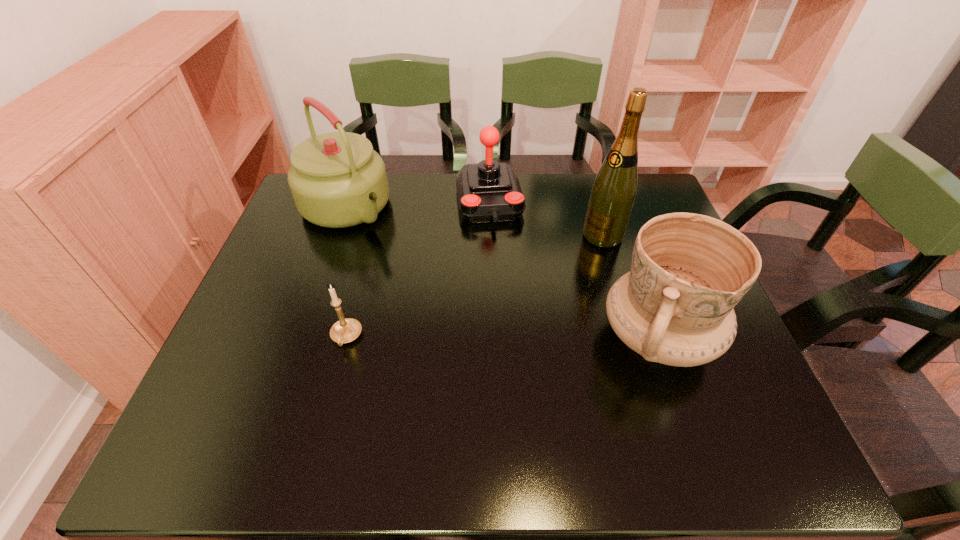
The height and width of the screenshot is (540, 960). In order to click on the shortest object in this screenshot , I will do `click(346, 330)`.

Where is `pottery`? pottery is located at coordinates (688, 271).

This screenshot has height=540, width=960. I want to click on joystick, so click(489, 191).

Image resolution: width=960 pixels, height=540 pixels. In order to click on the third object from left to right in this screenshot , I will do tap(489, 191).

You are a GUI agent. You are given a task and a screenshot of the screen. Output one action in this format:
    pyautogui.click(x=<x>, y=<y>)
    Task: Click on the tallest object
    The width and height of the screenshot is (960, 540).
    Given the screenshot: What is the action you would take?
    pyautogui.click(x=613, y=193)

You are a GUI agent. You are given a task and a screenshot of the screen. Output one action in this format:
    pyautogui.click(x=<x>, y=<y>)
    Task: Click on the kettle
    
    Given the screenshot: What is the action you would take?
    pyautogui.click(x=337, y=180)

Find the location of `vacant space located 0.100m on the handle side of the shortest object`. vacant space located 0.100m on the handle side of the shortest object is located at coordinates (331, 395).

Where is `vacant area situated on the back of the pottery`? This screenshot has height=540, width=960. vacant area situated on the back of the pottery is located at coordinates (629, 254).

The image size is (960, 540). I want to click on free space located 0.170m on the base of the joystick, so click(501, 272).

The image size is (960, 540). In order to click on vacant space located 0.400m on the base of the joystick in this screenshot , I will do `click(514, 345)`.